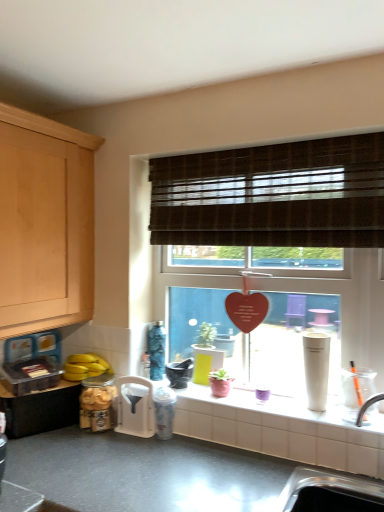
Question: Is yellow matte bananas at lower left inside the boundaries of matte white tile at center, or outside?

Choices:
 (A) inside
 (B) outside

Answer: (B)

Question: Is point (64, 367) closer or farther from the camera than point (253, 409)?

Choices:
 (A) farther
 (B) closer

Answer: (A)

Question: Which object is the closest to the metallic gray countertop at lower center?

Choices:
 (A) matte white tile at center
 (B) yellow matte bananas at lower left
 (C) silver metallic sink at lower right
 (D) matte glass jar at lower left, the 1th appliance from the left
 (E) brown woven blind at upper center

Answer: (A)

Question: Which object is the closest to the white plastic funnel at lower center, positioned as the second appliance in left-to-right order?

Choices:
 (A) wooden heart at center
 (B) matte glass jar at lower left, the 1th appliance from the left
 (C) black matte cabinet at lower left
 (D) silver metallic sink at lower right
 (E) matte black mortar at center, which is the first appliance in right-to-left order

Answer: (B)